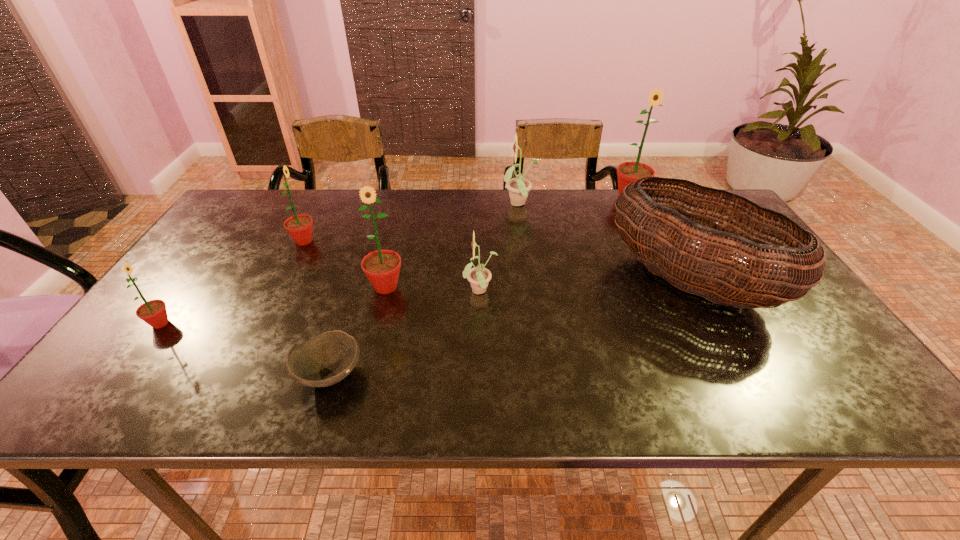
At what (x,y) coordinates should I click in order to perform the action: click on free spot located 0.240m on the face of the third biggest green sunflower. Please return your answer as a coordinate pair (x, y). The width and height of the screenshot is (960, 540). Looking at the image, I should click on (400, 241).

I want to click on vacant space located on the front of the basket, so (753, 397).

The image size is (960, 540). I want to click on vacant region located on the front-facing side of the nearer yellow sunflower, so click(342, 292).

Locate an element on the screen. free location located 0.170m on the front-facing side of the nearer yellow sunflower is located at coordinates (396, 292).

This screenshot has height=540, width=960. In order to click on vacant space located on the front-facing side of the nearer yellow sunflower in this screenshot , I will do click(x=334, y=292).

I want to click on free space located on the face of the leftmost sunflower, so (x=241, y=323).

Identify the location of vacant region located 0.140m on the left of the nearest object. (228, 374).

Where is `object positioned at the near edge`? object positioned at the near edge is located at coordinates (326, 359).

In order to click on object that is at the left edge in this screenshot , I will do `click(153, 312)`.

Identify the location of object located in the right edge section of the desktop. The image size is (960, 540). (789, 278).